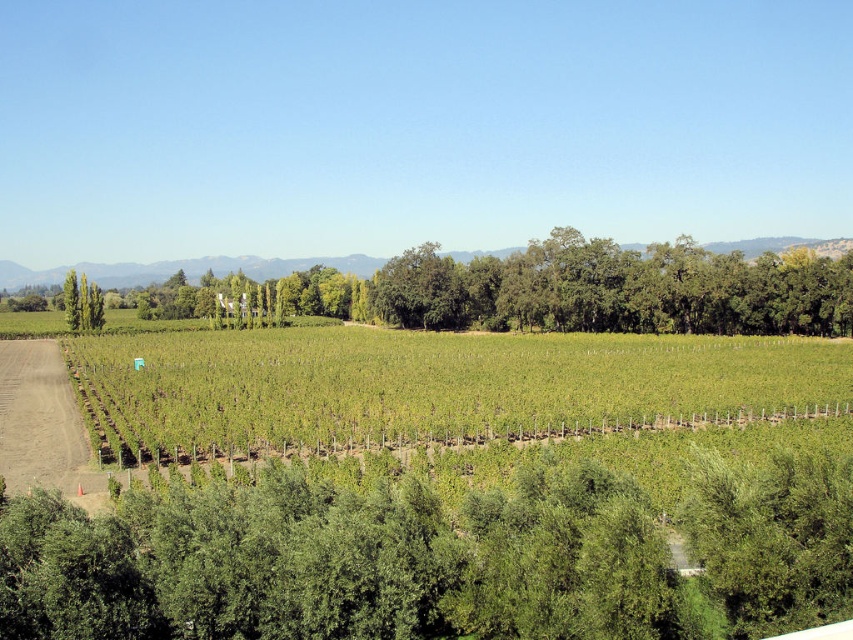
Between green leafy tree at lower center and green grassy field at center, which one has more height?

green grassy field at center is taller.

Does green leafy tree at lower center have a lesser height compared to green grassy field at center?

Correct, green leafy tree at lower center is not as tall as green grassy field at center.

Is point (340, 541) behind point (838, 342)?

No, it is not.

Find the location of a particular element. green leafy tree at lower center is located at coordinates (434, 557).